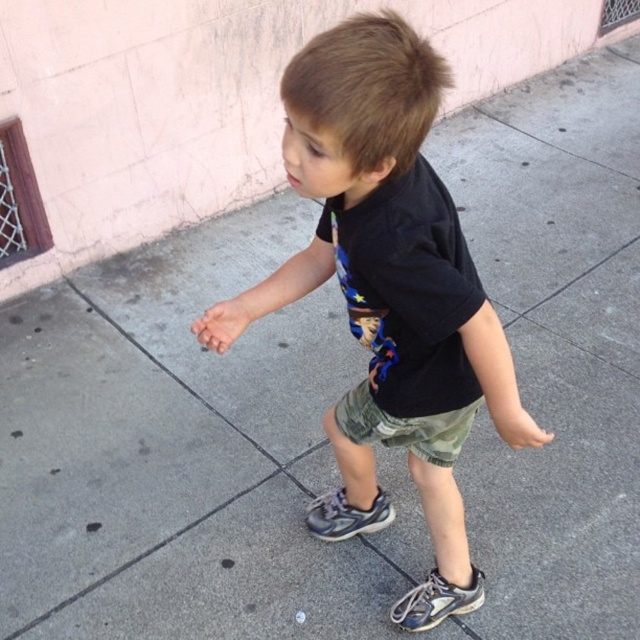
Question: Which of these objects is positioned farthest from the black cotton shirt at center?

Choices:
 (A) gray suede sneaker at center
 (B) camo fabric shorts at center
 (C) gray mesh shoe at lower center

Answer: (C)

Question: Which point is closer to the camera taking this photo?

Choices:
 (A) (465, 436)
 (B) (371, 515)

Answer: (A)

Question: Considering the relative positions of black cotton shirt at center and gray mesh shoe at lower center in the image provided, where is black cotton shirt at center located with respect to gray mesh shoe at lower center?

Choices:
 (A) left
 (B) right

Answer: (A)

Question: Can you confirm if gray mesh shoe at lower center is smaller than gray suede sneaker at center?

Choices:
 (A) yes
 (B) no

Answer: (B)

Question: Does camo fabric shorts at center appear over gray mesh shoe at lower center?

Choices:
 (A) yes
 (B) no

Answer: (A)

Question: Which of the following is the closest to the observer?

Choices:
 (A) (401, 616)
 (B) (337, 508)
 (C) (428, 84)
 (D) (444, 456)

Answer: (C)